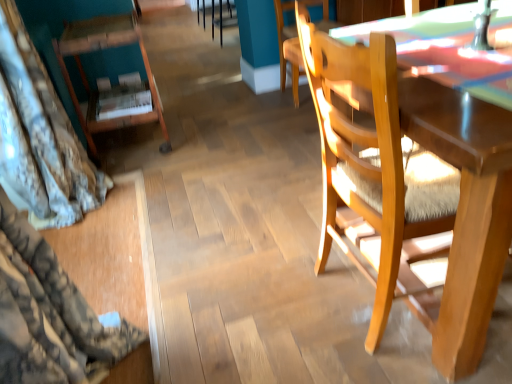
Question: Is wooden chair at right, which appears as the 3th chair when viewed from the back, in front of or behind wooden bookshelf at left, placed as the 1th chair when sorted from left to right, in the image?

Choices:
 (A) front
 (B) behind

Answer: (A)

Question: Based on their sizes in the image, would you say wooden chair at right, arranged as the first chair when viewed from the front, is bigger or smaller than wooden bookshelf at left, which is counted as the 3th chair, starting from the right?

Choices:
 (A) small
 (B) big

Answer: (B)

Question: Estimate the real-world distances between objects in this image. Which object is closer to the wooden chair at center, which ranks as the 2th chair in right-to-left order?

Choices:
 (A) wooden bookshelf at left, the 2th chair in the back-to-front sequence
 (B) wooden chair at right, which appears as the 3th chair when viewed from the back

Answer: (A)

Question: Considering the real-world distances, which object is farthest from the wooden bookshelf at left, placed as the 1th chair when sorted from left to right?

Choices:
 (A) wooden chair at right, which appears as the 3th chair when viewed from the back
 (B) wooden chair at center, the 2th chair positioned from the left

Answer: (A)